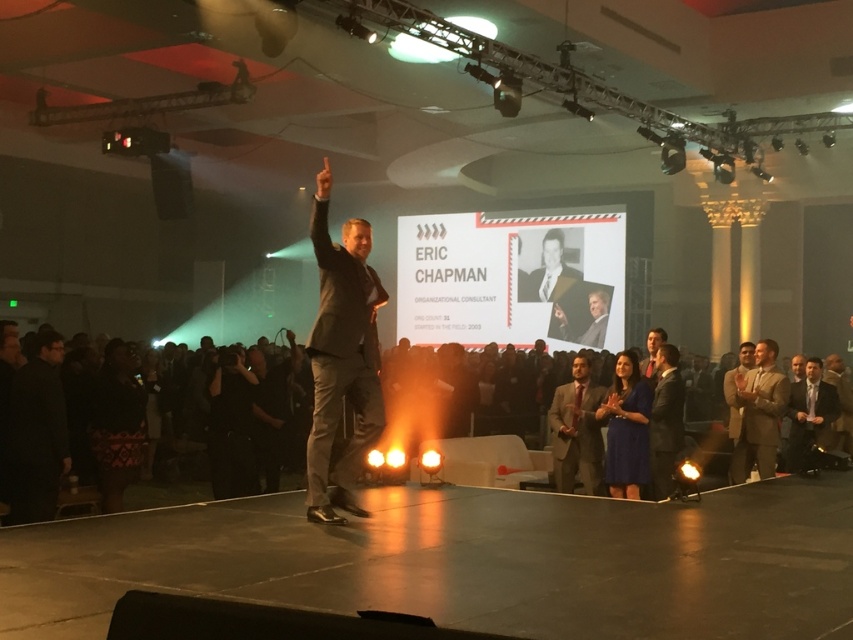
Question: Does dark gray suit at center lie in front of dark suit at lower center?

Choices:
 (A) no
 (B) yes

Answer: (B)

Question: Which point is farther from the camera taking this photo?

Choices:
 (A) (753, 364)
 (B) (369, 308)
 (C) (289, 476)

Answer: (C)

Question: Which object is farther from the camera taking this photo?

Choices:
 (A) matte gold suit at right
 (B) dark suit at lower center
 (C) dark gray suit at center

Answer: (A)

Question: Which is farther from the dark gray suit at center?

Choices:
 (A) dark suit at lower center
 (B) matte gold suit at right

Answer: (B)

Question: Does dark gray suit at center appear on the right side of matte gold suit at right?

Choices:
 (A) yes
 (B) no

Answer: (B)

Question: Does dark gray suit at center appear on the right side of dark suit at lower center?

Choices:
 (A) yes
 (B) no

Answer: (B)